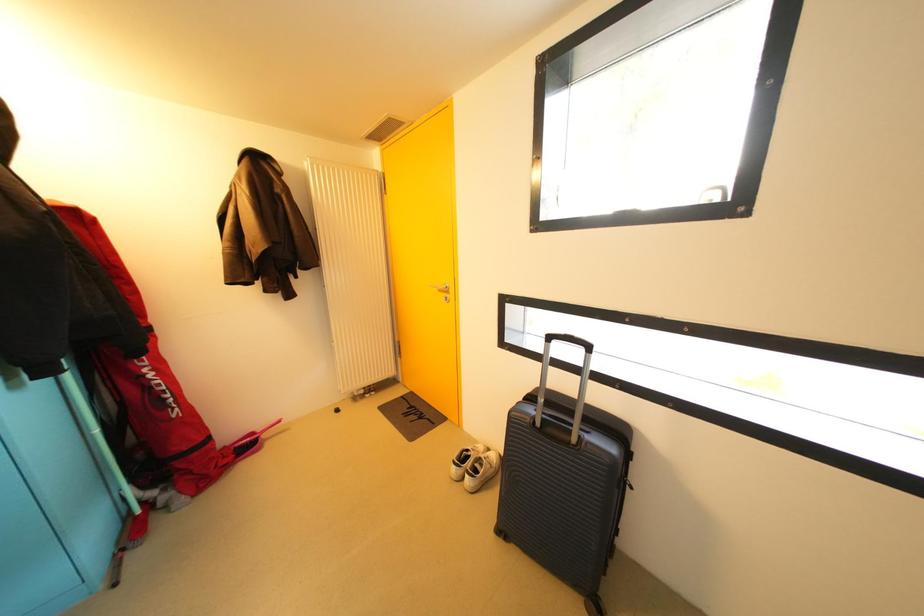
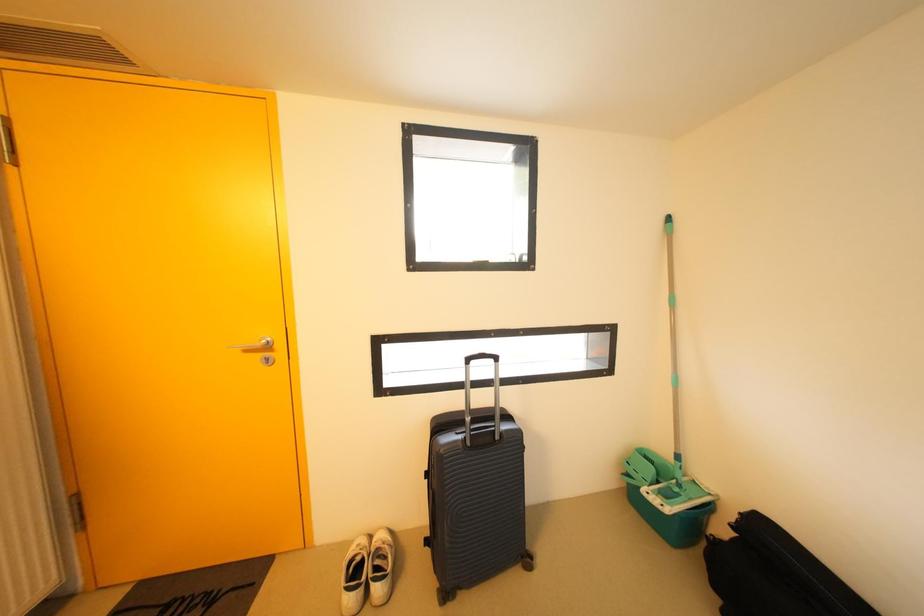
Question: The camera is either moving clockwise (left) or counter-clockwise (right) around the object. The first image is from the beginning of the video and the second image is from the end. Is the camera moving left or right when shooting the video?

Choices:
 (A) Left
 (B) Right

Answer: (A)